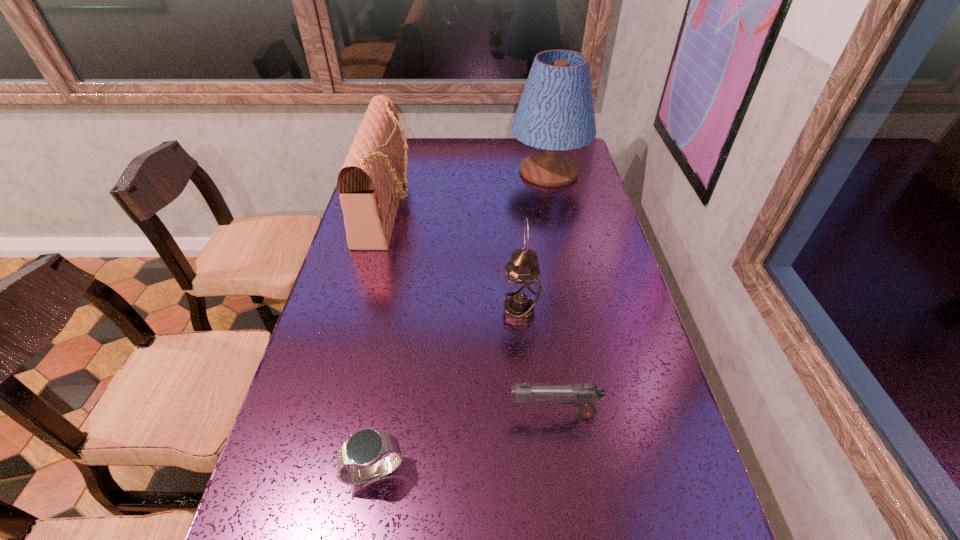
The image size is (960, 540). What are the coordinates of `lampshade` in the screenshot? It's located at (556, 112).

Locate an element on the screen. This screenshot has height=540, width=960. oil lamp is located at coordinates (522, 288).

Locate an element on the screen. The image size is (960, 540). handbag is located at coordinates (370, 183).

At what (x,y) coordinates should I click in order to perform the action: click on gun. Please return your answer as a coordinate pair (x, y). The image size is (960, 540). Looking at the image, I should click on (582, 395).

This screenshot has width=960, height=540. Identify the location of the nearest object. (363, 450).

Where is `free region located on the left of the lampshade`? Image resolution: width=960 pixels, height=540 pixels. free region located on the left of the lampshade is located at coordinates (441, 171).

What are the coordinates of `vacant space situated 0.120m on the back of the third farthest object` in the screenshot? It's located at (516, 268).

What are the coordinates of `vacant area situated 0.200m on the front-facing side of the handbag` in the screenshot? It's located at (469, 207).

Image resolution: width=960 pixels, height=540 pixels. I want to click on vacant space situated in the direction the fourth farthest object is aimed, so click(x=422, y=415).

What are the coordinates of `free space located 0.190m in the direction the fourth farthest object is aimed` in the screenshot? It's located at (422, 415).